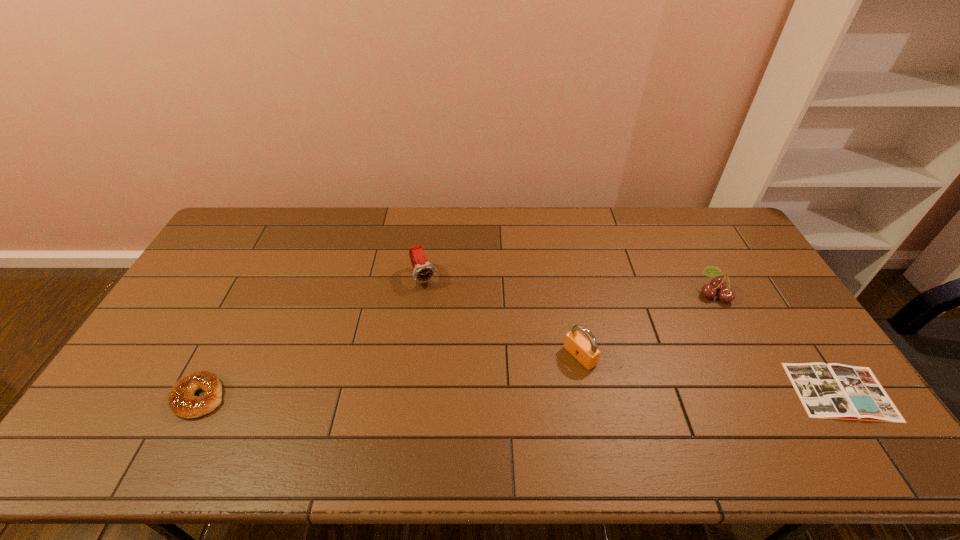
Locate an element on the screen. Image resolution: width=960 pixels, height=540 pixels. book at the near edge is located at coordinates (830, 391).

Find the location of `object that is positioned at the left edge`. object that is positioned at the left edge is located at coordinates (182, 401).

Where is `book situated at the right edge`? book situated at the right edge is located at coordinates (830, 391).

At what (x,y) coordinates should I click in order to perform the action: click on cherry at the right edge. Please return your answer as a coordinate pair (x, y). The image size is (960, 540). Looking at the image, I should click on (718, 284).

Find the location of a particular element. Image resolution: width=960 pixels, height=540 pixels. object at the near left corner is located at coordinates (182, 401).

This screenshot has height=540, width=960. I want to click on object at the near right corner, so click(830, 391).

The width and height of the screenshot is (960, 540). In the image, there is a desktop. Identify the location of free space at the far edge. click(x=577, y=214).

In the image, there is a desktop. Find the location of `vacant space at the near edge`. vacant space at the near edge is located at coordinates (277, 419).

Find the location of a particular element. Image resolution: width=960 pixels, height=540 pixels. free point at the left edge is located at coordinates (170, 337).

The width and height of the screenshot is (960, 540). What are the coordinates of `free spot at the right edge of the desktop` in the screenshot? It's located at (770, 319).